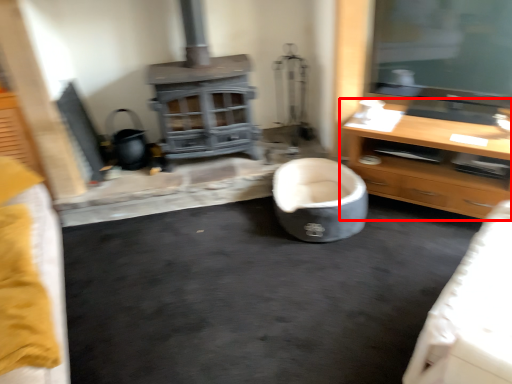
Question: From the image, what is the correct spatial relationship of cabinetry (annotated by the red box) in relation to bean bag chair?

Choices:
 (A) left
 (B) right

Answer: (B)